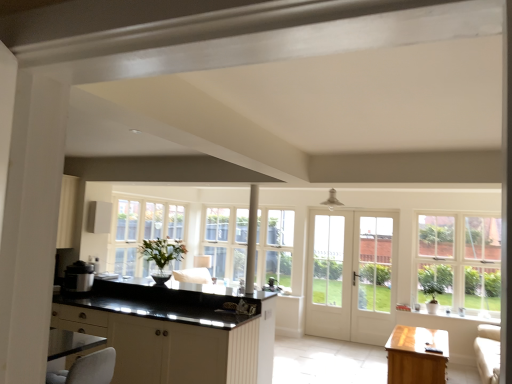
Question: From the image's perspective, does light brown wooden table at lower right appear lower than white glass door at center, which is counted as the first screen door, starting from the right?

Choices:
 (A) no
 (B) yes

Answer: (B)

Question: Considering the relative sizes of light brown wooden table at lower right and white glass door at center, which is counted as the first screen door, starting from the right, in the image provided, is light brown wooden table at lower right thinner than white glass door at center, which is counted as the first screen door, starting from the right,?

Choices:
 (A) no
 (B) yes

Answer: (A)

Question: Considering the relative positions of light brown wooden table at lower right and white glass door at center, the 2th screen door positioned from the left, in the image provided, is light brown wooden table at lower right to the left of white glass door at center, the 2th screen door positioned from the left, from the viewer's perspective?

Choices:
 (A) yes
 (B) no

Answer: (B)

Question: Considering the relative positions of light brown wooden table at lower right and white glass door at center, which is counted as the first screen door, starting from the right, in the image provided, is light brown wooden table at lower right behind white glass door at center, which is counted as the first screen door, starting from the right,?

Choices:
 (A) yes
 (B) no

Answer: (B)

Question: Is light brown wooden table at lower right next to white glass door at center, which is counted as the first screen door, starting from the right, and touching it?

Choices:
 (A) yes
 (B) no

Answer: (B)

Question: Is light brown wooden table at lower right outside white glass door at center, which is counted as the first screen door, starting from the right?

Choices:
 (A) yes
 (B) no

Answer: (A)

Question: Considering the relative sizes of white glass door at center, which is counted as the first screen door, starting from the right, and white glass door at center, placed as the first screen door when sorted from left to right, in the image provided, is white glass door at center, which is counted as the first screen door, starting from the right, taller than white glass door at center, placed as the first screen door when sorted from left to right,?

Choices:
 (A) yes
 (B) no

Answer: (B)

Question: Is white glass door at center, which is counted as the first screen door, starting from the right, at the left side of white glass door at center, which is counted as the second screen door, starting from the right?

Choices:
 (A) no
 (B) yes

Answer: (A)

Question: Is white glass door at center, the 2th screen door positioned from the left, shorter than white glass door at center, placed as the first screen door when sorted from left to right?

Choices:
 (A) no
 (B) yes

Answer: (B)

Question: Is white glass door at center, which is counted as the first screen door, starting from the right, smaller than white glass door at center, which is counted as the second screen door, starting from the right?

Choices:
 (A) yes
 (B) no

Answer: (B)

Question: Is white glass door at center, the 2th screen door positioned from the left, aimed at white glass door at center, which is counted as the second screen door, starting from the right?

Choices:
 (A) no
 (B) yes

Answer: (A)

Question: From the image's perspective, is white glass door at center, which is counted as the first screen door, starting from the right, below white glass door at center, which is counted as the second screen door, starting from the right?

Choices:
 (A) no
 (B) yes

Answer: (B)

Question: Is light brown wooden table at lower right positioned far away from white glass door at center, which is counted as the second screen door, starting from the right?

Choices:
 (A) yes
 (B) no

Answer: (A)